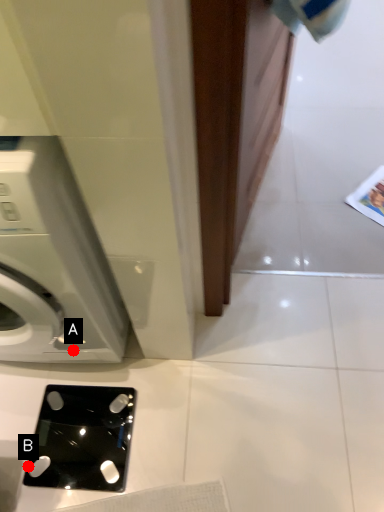
Question: Two points are circled on the image, labeled by A and B beside each circle. Which of the following is the farthest from the observer?

Choices:
 (A) A is further
 (B) B is further

Answer: (A)